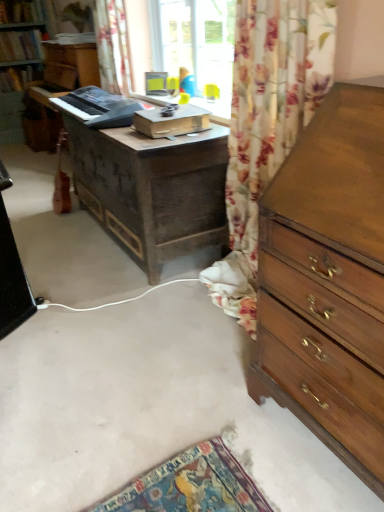
I want to click on vacant point to the left of dark brown wooden desk at center, so (55, 233).